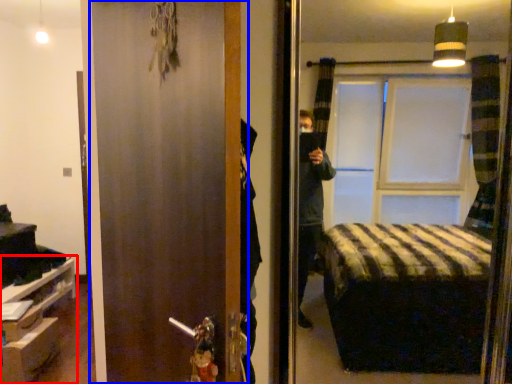
Question: Which object appears farthest to the camera in this image, furniture (highlighted by a red box) or door (highlighted by a blue box)?

Choices:
 (A) furniture
 (B) door

Answer: (A)